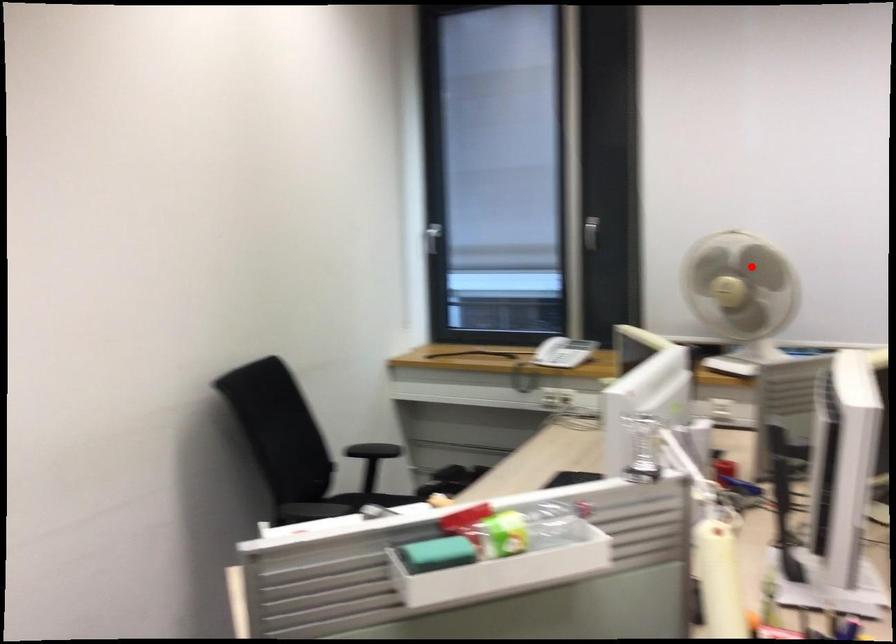
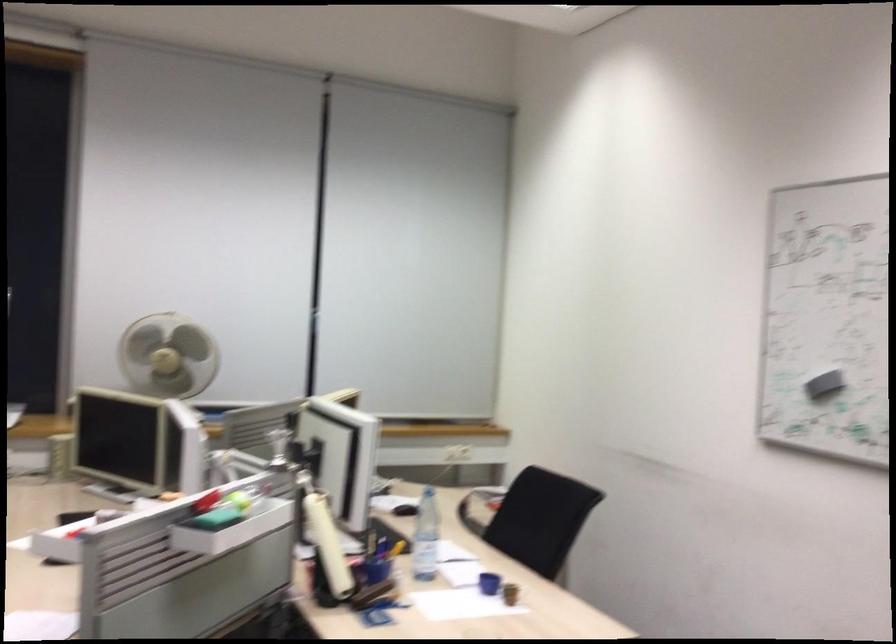
Question: A red point is marked in image1. In image2, is the corresponding 3D point closer to the camera or farther? Reply with the corresponding letter.

Choices:
 (A) The corresponding 3D point is closer.
 (B) The corresponding 3D point is farther.

Answer: (B)